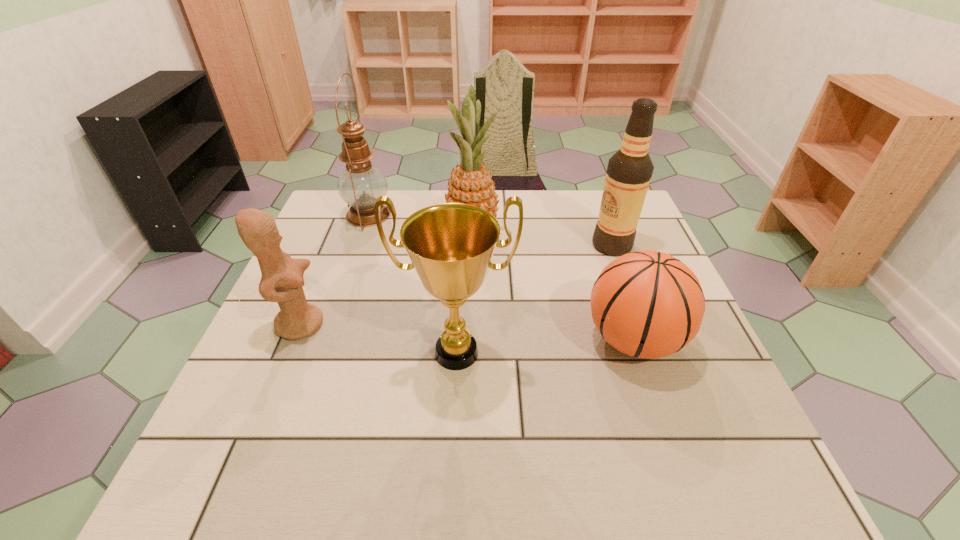
Locate an element on the screen. basketball positioned at the right edge is located at coordinates (648, 304).

Locate an element on the screen. object that is at the far left corner is located at coordinates (360, 184).

Where is `object at the far right corner`? The height and width of the screenshot is (540, 960). object at the far right corner is located at coordinates click(x=629, y=171).

Locate an element on the screen. The width and height of the screenshot is (960, 540). vacant space at the far edge of the desktop is located at coordinates (376, 232).

Locate an element on the screen. free spot at the near edge of the desktop is located at coordinates (568, 457).

You are a GUI agent. You are given a task and a screenshot of the screen. Output one action in this format:
    pyautogui.click(x=<x>, y=<y>)
    Task: Click on the vacant space at the left edge of the desktop
    
    Given the screenshot: What is the action you would take?
    [259, 359]

The image size is (960, 540). In the image, there is a desktop. Find the location of `vacant space at the near right corner`. vacant space at the near right corner is located at coordinates (x=744, y=464).

Image resolution: width=960 pixels, height=540 pixels. Find the location of `free space between the award and the fifth tallest object`. free space between the award and the fifth tallest object is located at coordinates (378, 338).

Find the location of `free space between the oil lamp and the shortest object`. free space between the oil lamp and the shortest object is located at coordinates (501, 278).

Locate an element on the screen. The width and height of the screenshot is (960, 540). free spot between the shortest object and the award is located at coordinates (x=545, y=346).